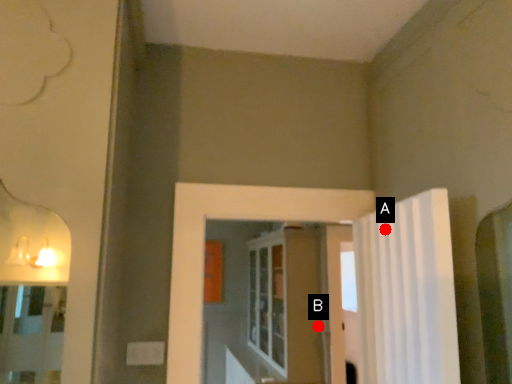
Question: Two points are circled on the image, labeled by A and B beside each circle. Which of the following is the farthest from the observer?

Choices:
 (A) A is further
 (B) B is further

Answer: (B)